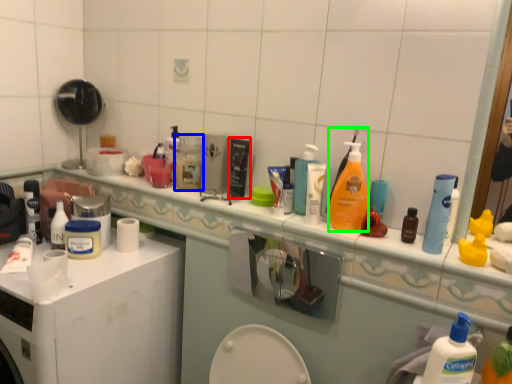
Question: Considering the real-world distances, which object is closest to product (highlighted by a red box)? mouthwash (highlighted by a blue box) or cleaning product (highlighted by a green box).

Choices:
 (A) mouthwash
 (B) cleaning product

Answer: (A)